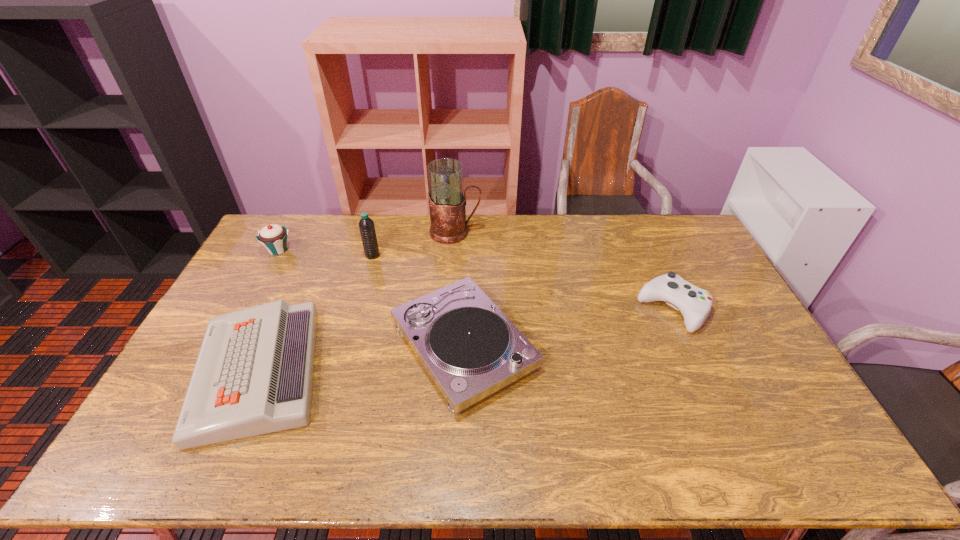
Locate an element on the screen. vacant space located 0.050m on the right of the third shortest object is located at coordinates (556, 346).

The width and height of the screenshot is (960, 540). Find the location of `free space located 0.100m on the right of the control`. free space located 0.100m on the right of the control is located at coordinates (738, 309).

Where is `free spot located on the right of the computer keyboard`? This screenshot has height=540, width=960. free spot located on the right of the computer keyboard is located at coordinates (445, 371).

Where is `pitcher that is positioned at the far edge`? pitcher that is positioned at the far edge is located at coordinates (447, 200).

This screenshot has height=540, width=960. Identify the location of water bottle that is at the far edge. (366, 225).

Find the location of a particular element. cupcake present at the far edge is located at coordinates (273, 237).

Locate an element on the screen. The width and height of the screenshot is (960, 540). object that is at the near edge is located at coordinates (254, 373).

Identify the location of cupcake at the left edge. (273, 237).

Image resolution: width=960 pixels, height=540 pixels. In order to click on computer keyboard present at the left edge in this screenshot , I will do `click(254, 373)`.

Identify the location of object positioned at the right edge. The width and height of the screenshot is (960, 540). (x=694, y=303).